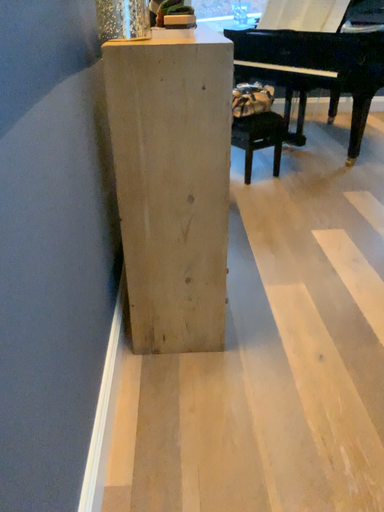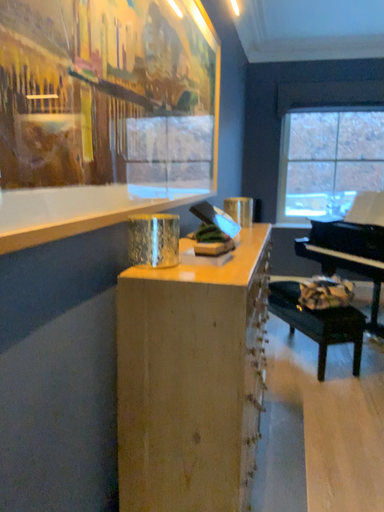
Question: How did the camera likely rotate when shooting the video?

Choices:
 (A) rotated right
 (B) rotated left

Answer: (B)